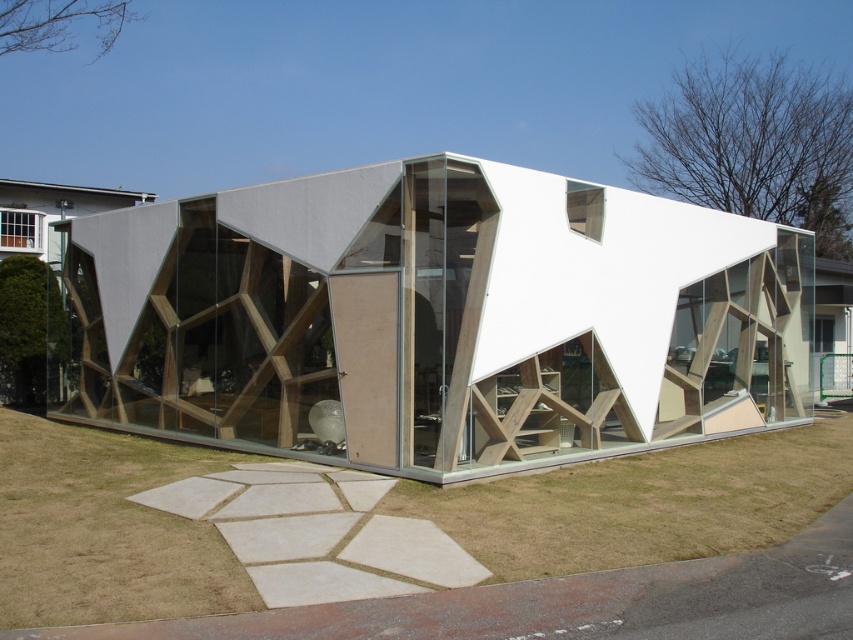
You are standing in front of the modern architectural structure described. Where is the white matte wooden structure at center located in the image?

The white matte wooden structure at center is located at point coordinates of approximately (434, 317).

You are standing on the green grass at lower center and want to reach the white matte wooden structure at center. Which direction should you move to get there?

The white matte wooden structure at center is located above the green grass at lower center, so you should move upward to reach it.